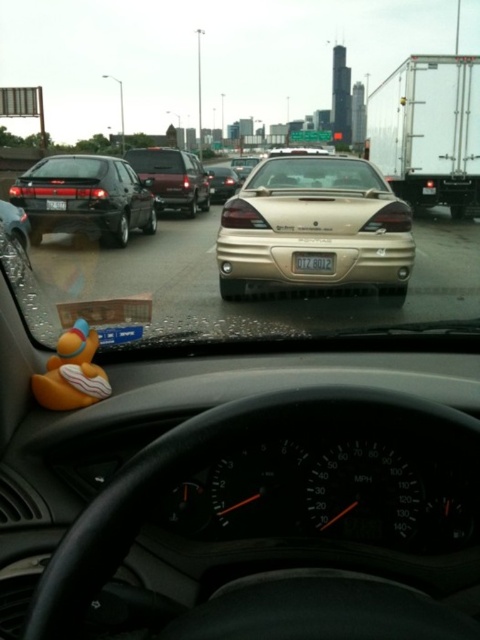
You are driving a car and notice a satin dark red sedan at center on the road ahead. Based on its position, can you estimate if it is in the left or right lane of the highway?

The satin dark red sedan at center is located at point coordinates that place it in the center of the highway, so it is likely in the middle lane rather than the left or right lanes.